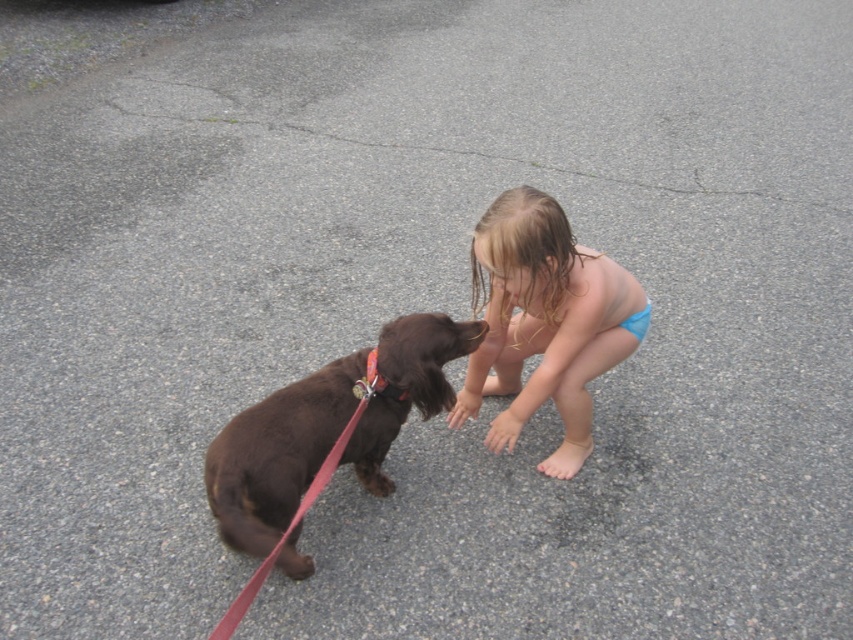
Measure the distance from shiny brown dog at center to blue fabric bikini at center.

They are 18.31 inches apart.

Which is below, shiny brown dog at center or blue fabric bikini at center?

shiny brown dog at center

Image resolution: width=853 pixels, height=640 pixels. What do you see at coordinates (323, 440) in the screenshot?
I see `shiny brown dog at center` at bounding box center [323, 440].

The image size is (853, 640). In order to click on shiny brown dog at center in this screenshot , I will do tap(323, 440).